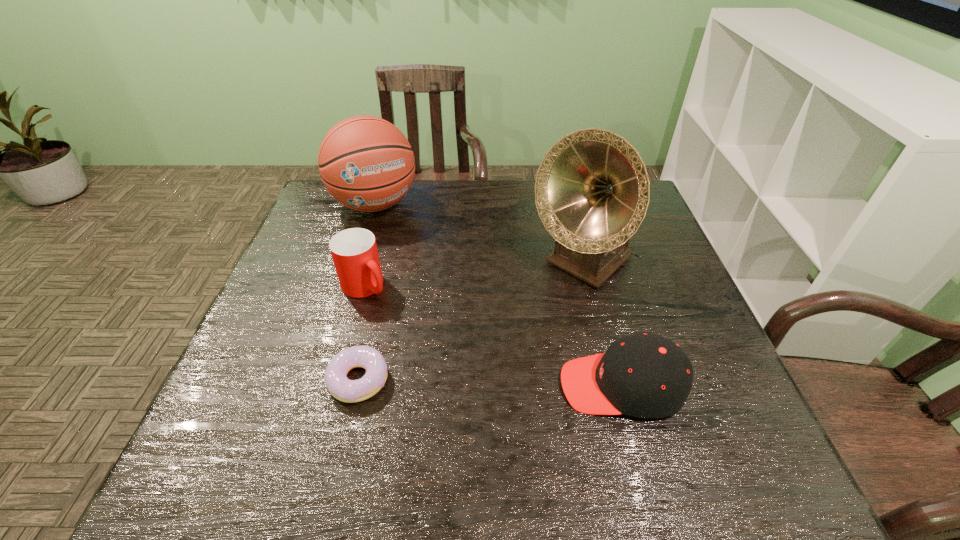
Locate an element on the screen. the shortest object is located at coordinates (343, 389).

Locate an element on the screen. This screenshot has width=960, height=540. cap is located at coordinates (647, 376).

At what (x,y) coordinates should I click in order to perform the action: click on phonograph record. Please return your answer as a coordinate pair (x, y). The image size is (960, 540). Looking at the image, I should click on (592, 190).

Identify the location of cup. (354, 251).

At what (x,y) coordinates should I click in order to perform the action: click on the farthest object. Please return your answer as a coordinate pair (x, y). The image size is (960, 540). Looking at the image, I should click on (366, 163).

Where is `basketball`? This screenshot has height=540, width=960. basketball is located at coordinates (366, 163).

I want to click on vacant space located 0.050m on the left of the shortest object, so click(304, 380).

Locate an element on the screen. This screenshot has width=960, height=540. free space located on the front-facing side of the cap is located at coordinates (497, 386).

At what (x,y) coordinates should I click in order to perform the action: click on free space located on the front-facing side of the cap. Please return your answer as a coordinate pair (x, y). Looking at the image, I should click on (375, 386).

Image resolution: width=960 pixels, height=540 pixels. What are the coordinates of `vacant area situated 0.080m on the front-facing side of the cap` in the screenshot? It's located at (521, 386).